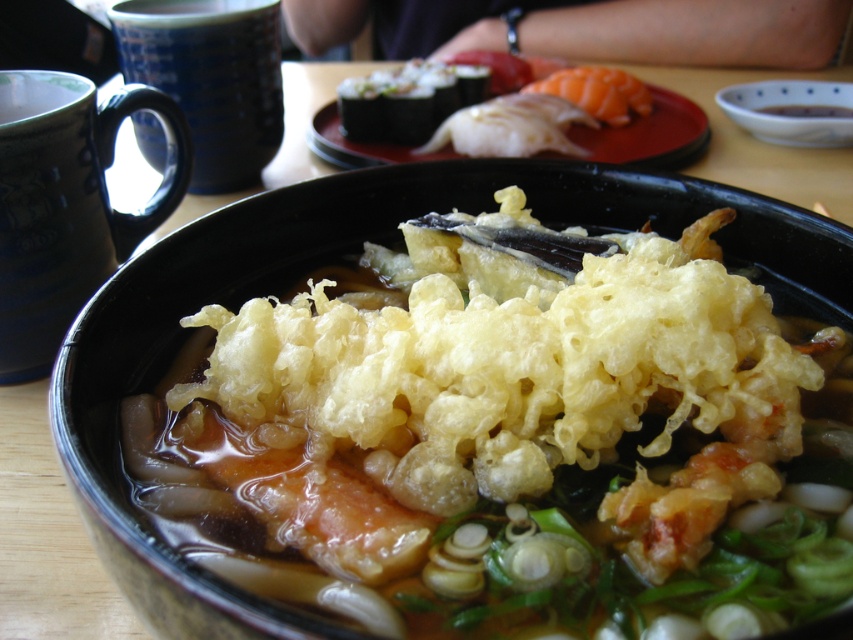
You are a barista preparing drinks and see the matte ceramic mug at upper left and the blue ceramic mug at upper left. You need to place a drink order that requires two mugs to be placed exactly 25 centimeters apart. Can you fit both mugs on the counter without moving any other items?

The matte ceramic mug at upper left is 25.71 centimeters away from the blue ceramic mug at upper left. Since the required distance is 25 centimeters, the mugs are already slightly farther apart than needed. You can move them closer by 0.71 centimeters to meet the requirement.

You are at a Japanese restaurant and see two mugs on the table. The matte ceramic mug at upper left and the blue ceramic mug at upper left. Which one is closer to you?

The matte ceramic mug at upper left is closer to the viewer than the blue ceramic mug at upper left.

You are a food delivery person who needs to place the golden crispy tempura at center and the blue ceramic mug at upper left into a delivery box. The box has a maximum length of 30 inches. Can you fit both items in the box without overlapping?

The golden crispy tempura at center is 30.69 inches away from the blue ceramic mug at upper left. Since the distance between them exceeds the box length, they cannot be placed without overlapping within the 30 inches limit.